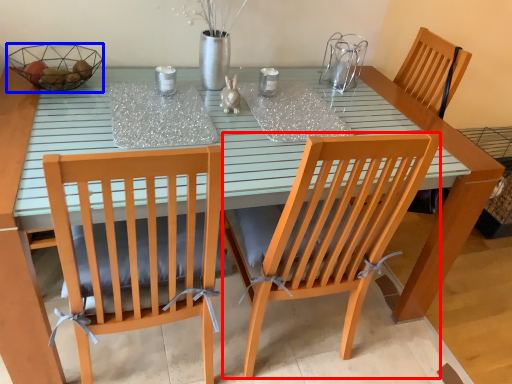
Question: Which object appears closest to the camera in this image, chair (highlighted by a red box) or glass bowl (highlighted by a blue box)?

Choices:
 (A) chair
 (B) glass bowl

Answer: (A)